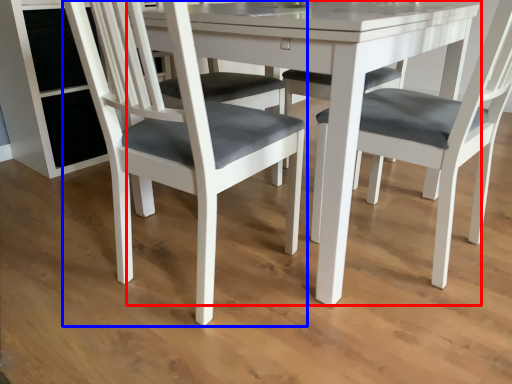
Question: Which point is further to the camera, round table (highlighted by a red box) or chair (highlighted by a blue box)?

Choices:
 (A) round table
 (B) chair

Answer: (A)